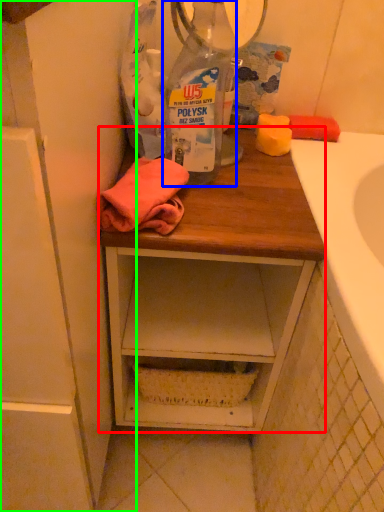
Question: Considering the real-world distances, which object is farthest from desk (highlighted by a red box)? bottle (highlighted by a blue box) or cabinetry (highlighted by a green box)?

Choices:
 (A) bottle
 (B) cabinetry

Answer: (A)